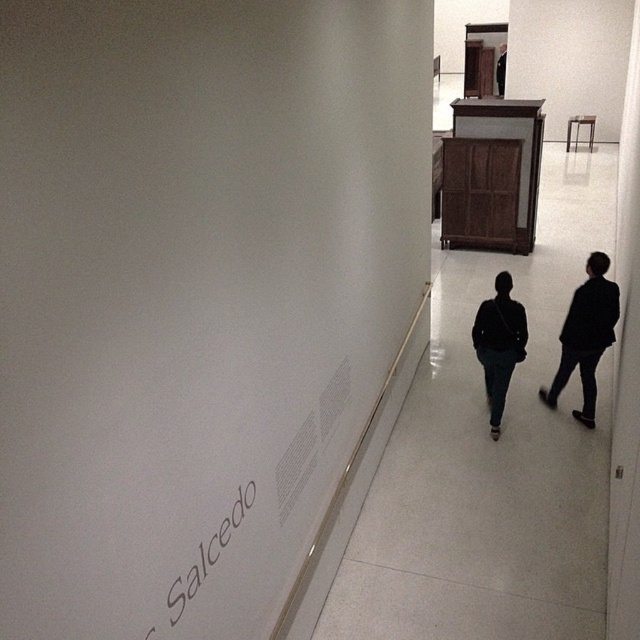
In the scene shown: Who is positioned more to the left, black fabric bag at center or gray paper salcedo at lower left?

Positioned to the left is gray paper salcedo at lower left.

Is point (483, 362) positioned after point (150, 636)?

Yes, it is behind point (150, 636).

Is point (502, 360) positioned before point (228, 538)?

No, it is behind (228, 538).

Where is `black fabric bag at center`? Image resolution: width=640 pixels, height=640 pixels. black fabric bag at center is located at coordinates (499, 344).

Does gray paper salcedo at lower left have a greater height compared to dark brown leather jacket at upper center?

In fact, gray paper salcedo at lower left may be shorter than dark brown leather jacket at upper center.

The width and height of the screenshot is (640, 640). What do you see at coordinates (208, 554) in the screenshot?
I see `gray paper salcedo at lower left` at bounding box center [208, 554].

Is point (204, 577) positioned after point (502, 65)?

No.

The height and width of the screenshot is (640, 640). I want to click on gray paper salcedo at lower left, so click(x=208, y=554).

Consider the image. Between dark fabric jacket at center and black matte jacket at right, which one has less height?

dark fabric jacket at center is shorter.

This screenshot has height=640, width=640. What do you see at coordinates (586, 336) in the screenshot? I see `dark fabric jacket at center` at bounding box center [586, 336].

Where is `dark fabric jacket at center`? dark fabric jacket at center is located at coordinates (586, 336).